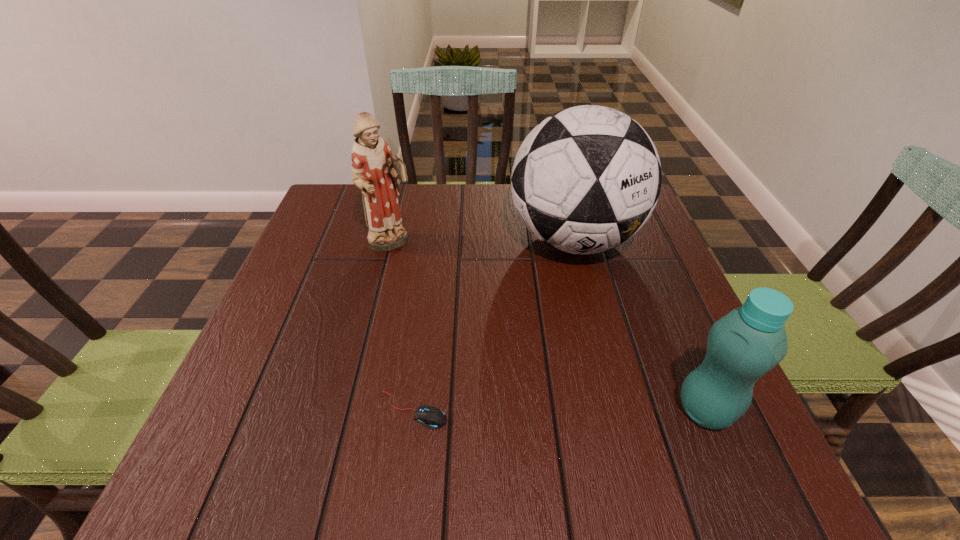
Where is `vacant space that satisfies the following two spatial constraints: 1. on the front side of the soccer ball; 2. at the front cap of the second shortest object`? This screenshot has height=540, width=960. vacant space that satisfies the following two spatial constraints: 1. on the front side of the soccer ball; 2. at the front cap of the second shortest object is located at coordinates (618, 410).